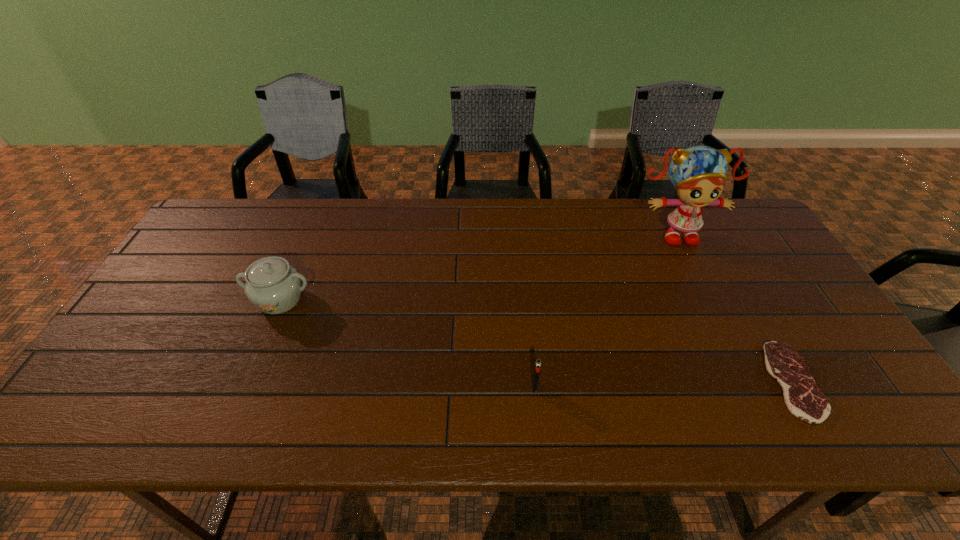
Identify the location of vacant space at the right edge. This screenshot has height=540, width=960. (736, 254).

The image size is (960, 540). I want to click on vacant area at the far left corner, so click(x=250, y=203).

Locate an element on the screen. The height and width of the screenshot is (540, 960). vacant space at the far right corner of the desktop is located at coordinates (739, 219).

Identify the location of vacant area that lies between the second shortest object and the shortest object. (663, 384).

At what (x,y) coordinates should I click in order to perform the action: click on blank region between the chinaware and the shortest object. Please return your answer as a coordinate pair (x, y). The image size is (960, 540). Looking at the image, I should click on (537, 340).

Identify the location of free point between the second object from left to right and the steak. Image resolution: width=960 pixels, height=540 pixels. (663, 384).

The image size is (960, 540). I want to click on empty space that is in between the farthest object and the shortest object, so click(x=733, y=307).

Where is `unoccupied position between the leftmost object and the tallest object`? This screenshot has width=960, height=540. unoccupied position between the leftmost object and the tallest object is located at coordinates (477, 266).

At what (x,y) coordinates should I click in order to perform the action: click on free spot between the tallest object and the third object from right to left. Please return your answer as a coordinate pair (x, y). Image resolution: width=960 pixels, height=540 pixels. Looking at the image, I should click on (605, 309).

You are a GUI agent. You are given a task and a screenshot of the screen. Output one action in this format:
    pyautogui.click(x=<x>, y=<y>)
    Task: Click on the free area in between the shortest object and the farthest object
    The image size is (960, 540).
    Given the screenshot: What is the action you would take?
    pyautogui.click(x=733, y=307)